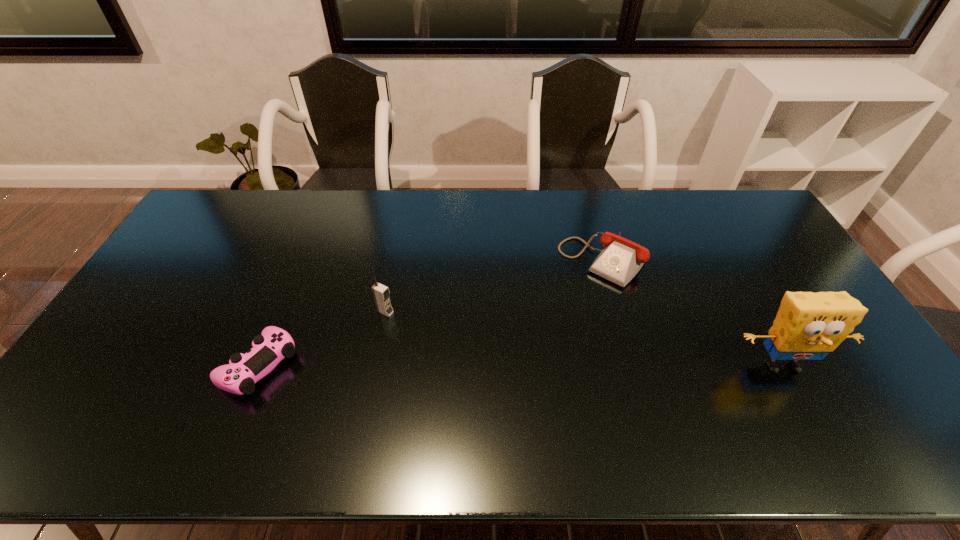
Locate an element on the screen. The height and width of the screenshot is (540, 960). free space at the right edge is located at coordinates (845, 374).

Find the location of a particular element. This screenshot has height=540, width=960. free region at the far left corner of the desktop is located at coordinates (235, 223).

Where is `free space at the near left corner`? The image size is (960, 540). free space at the near left corner is located at coordinates (111, 392).

Identify the location of blank area at the near right corner. (879, 402).

Locate an element on the screen. The width and height of the screenshot is (960, 540). free space between the control and the rightmost object is located at coordinates (520, 366).

I want to click on free space between the tallest object and the second object from right to left, so [693, 313].

The width and height of the screenshot is (960, 540). I want to click on vacant area that lies between the telephone and the leftmost object, so click(431, 313).

This screenshot has width=960, height=540. I want to click on free space that is in between the second farthest object and the rightmost object, so click(584, 339).

You are a GUI agent. You are given a task and a screenshot of the screen. Output one action in this format:
    pyautogui.click(x=<x>, y=<y>)
    Task: Click on the free space that is in between the leftmost object and the farthest object
    The height and width of the screenshot is (540, 960).
    Given the screenshot: What is the action you would take?
    pyautogui.click(x=431, y=313)

At what (x,y) coordinates should I click in order to perform the action: click on vacant space in between the rightmost object and the second object from left to right. Please return your answer as a coordinate pair (x, y). The width and height of the screenshot is (960, 540). Looking at the image, I should click on (584, 339).